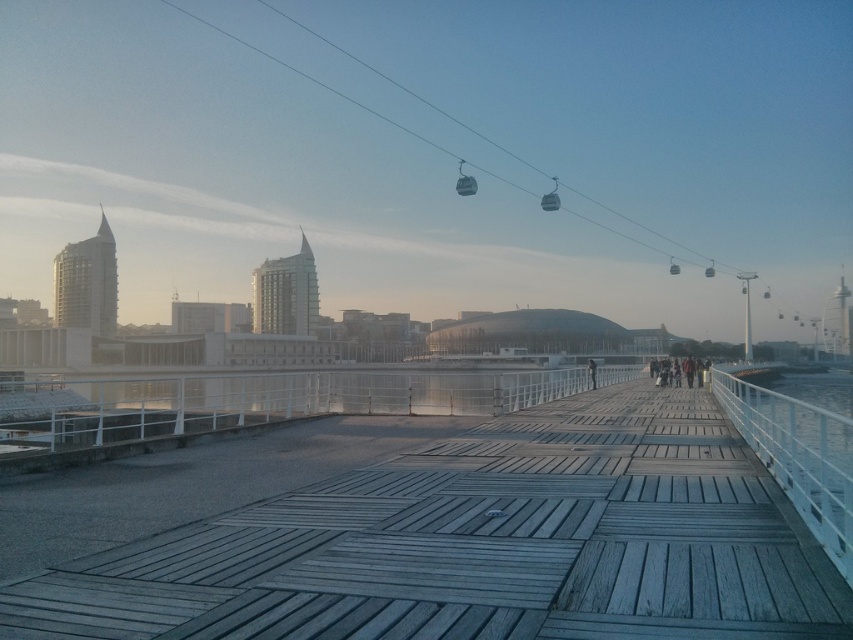
Question: Estimate the real-world distances between objects in this image. Which object is farther from the metallic cable car at upper center?

Choices:
 (A) dark gray fabric jacket at center-right
 (B) metallic cable car at center
 (C) wooden at center

Answer: (A)

Question: Is metallic cable car at center below metallic cable car at upper center?

Choices:
 (A) no
 (B) yes

Answer: (A)

Question: Can you confirm if metallic cable car at center is smaller than dark gray fabric jacket at center-right?

Choices:
 (A) yes
 (B) no

Answer: (B)

Question: Can you confirm if metallic cable car at upper center is positioned above dark gray fabric jacket at center-right?

Choices:
 (A) yes
 (B) no

Answer: (A)

Question: Which point is closer to the camera?

Choices:
 (A) metallic cable car at upper center
 (B) wooden at center

Answer: (B)

Question: Which point is closer to the camera?

Choices:
 (A) [592, 385]
 (B) [442, 596]
 (C) [460, 182]
 (D) [543, 209]

Answer: (B)